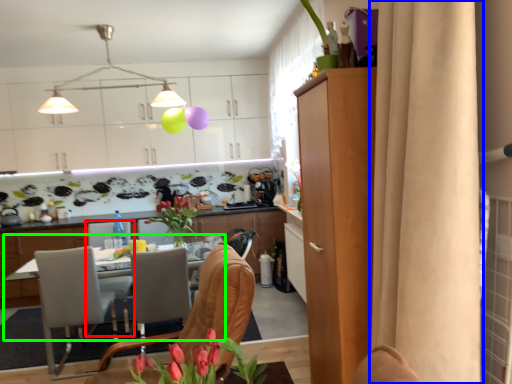
Question: Which is nearer to the armchair (highlighted by a red box)? curtain (highlighted by a blue box) or desk (highlighted by a green box).

Choices:
 (A) curtain
 (B) desk

Answer: (B)